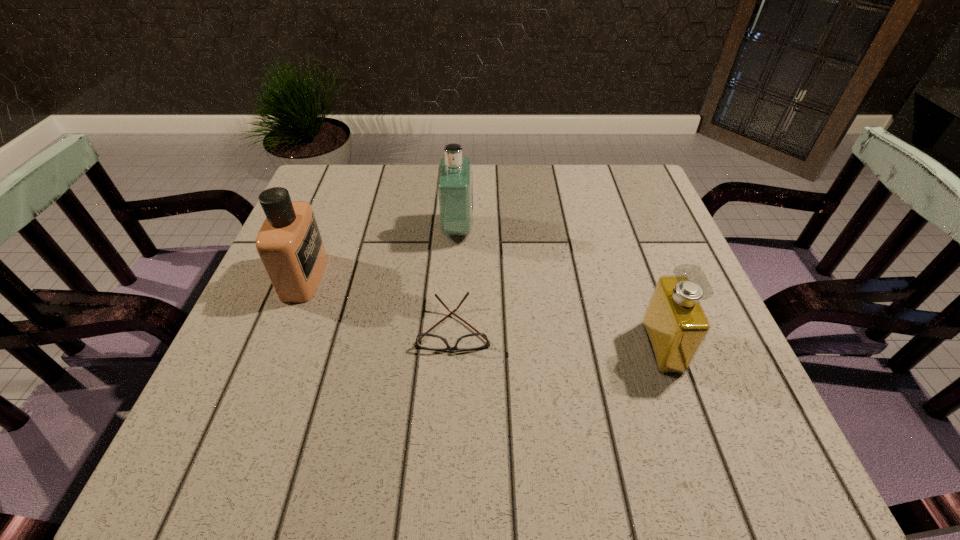
Where is `free region located 0.400m on the front-facing side of the rightmost object`? free region located 0.400m on the front-facing side of the rightmost object is located at coordinates (434, 347).

Locate an element on the screen. This screenshot has width=960, height=540. vacant space located 0.210m on the front-facing side of the rightmost object is located at coordinates (536, 347).

The width and height of the screenshot is (960, 540). I want to click on vacant space located on the front-facing side of the shortest object, so click(450, 381).

Identify the location of object that is at the far edge. (454, 185).

Find the location of a particular element. The width and height of the screenshot is (960, 540). object at the left edge is located at coordinates (289, 243).

Locate an element on the screen. The image size is (960, 540). object present at the right edge is located at coordinates (675, 324).

In order to click on vacant space at the far edge of the desktop in this screenshot , I will do `click(515, 194)`.

In the image, there is a desktop. Identify the location of free space at the near edge. Image resolution: width=960 pixels, height=540 pixels. (649, 421).

This screenshot has width=960, height=540. Identify the location of free region at the left edge of the desktop. (x=327, y=268).

In the image, there is a desktop. Identify the location of vacant space at the right edge. The image size is (960, 540). pos(663,233).